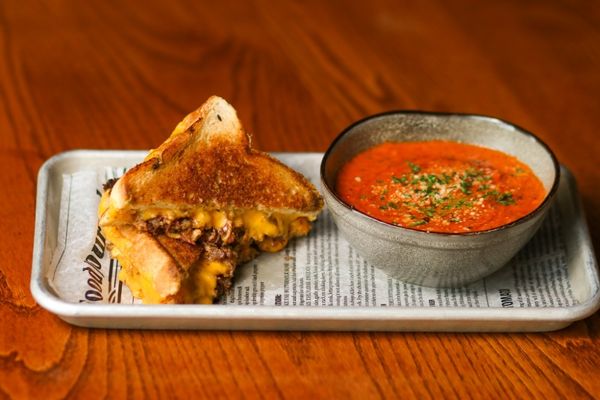
Where is `empty space on table`? The image size is (600, 400). empty space on table is located at coordinates (302, 365).